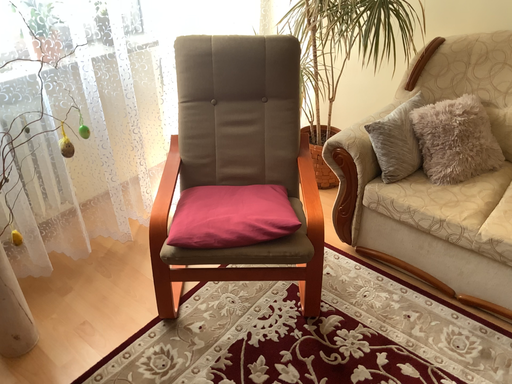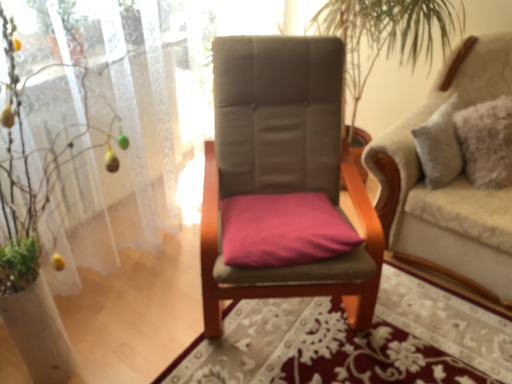
Question: Which way did the camera rotate in the video?

Choices:
 (A) rotated right
 (B) rotated left

Answer: (B)